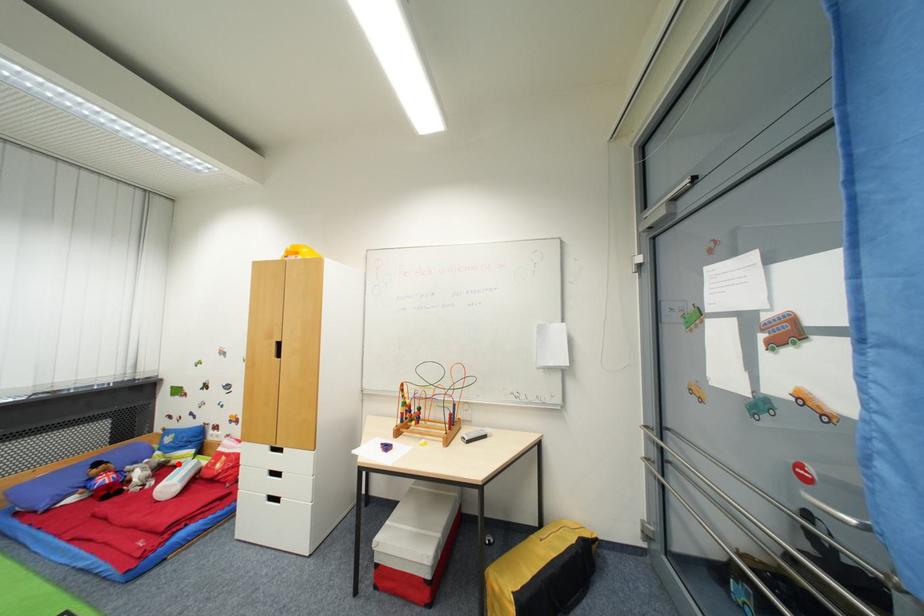
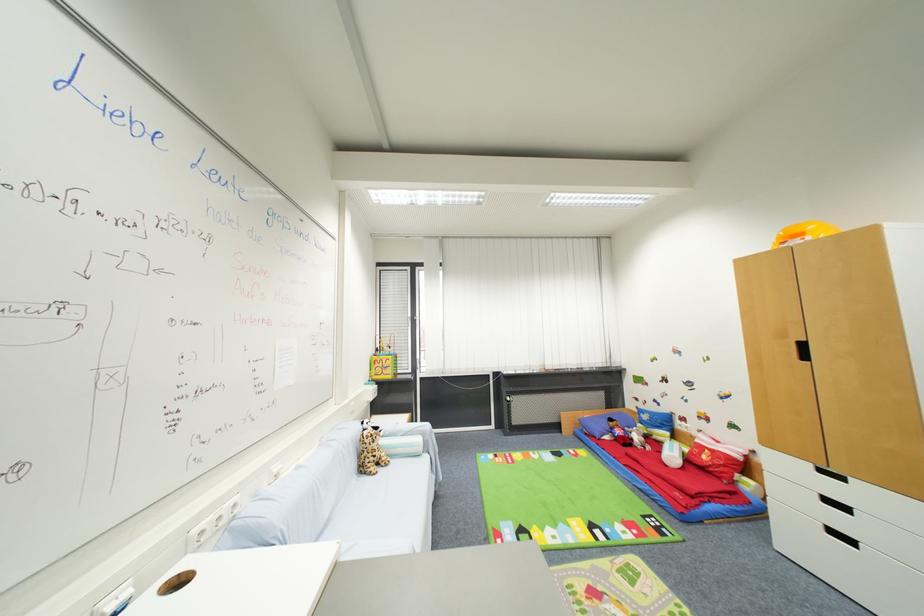
In the second image, find the point that corresponds to the highlighted location in the first image.

(660, 439)